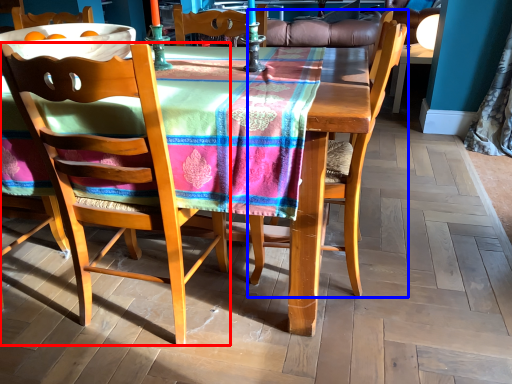
Question: Which object appears farthest to the camera in this image, chair (highlighted by a red box) or chair (highlighted by a blue box)?

Choices:
 (A) chair
 (B) chair

Answer: (B)